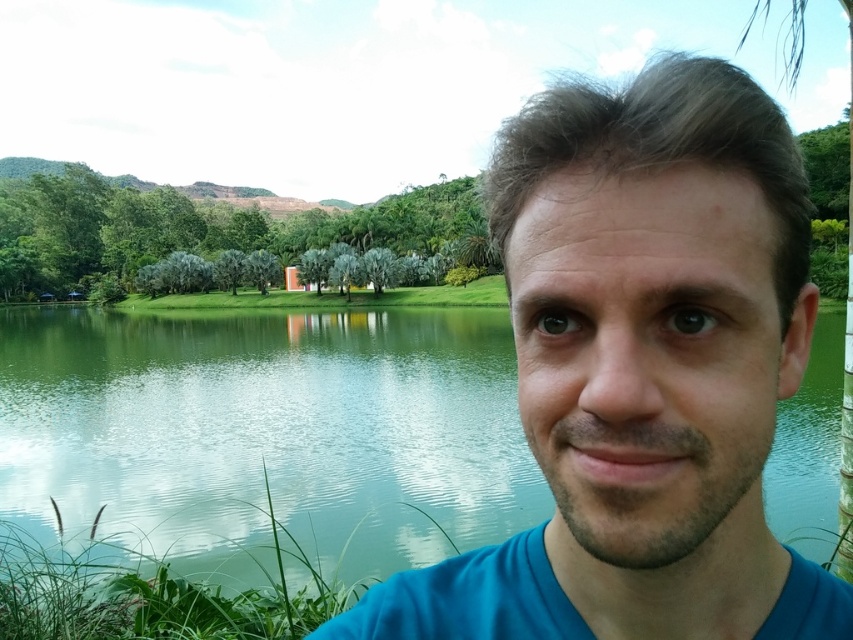
Does blue fabric face at center come behind green smooth water at center?

No.

Can you confirm if blue fabric face at center is wider than green smooth water at center?

In fact, blue fabric face at center might be narrower than green smooth water at center.

Is point (505, 566) positioned after point (395, 477)?

No.

Where is `blue fabric face at center`? This screenshot has width=853, height=640. blue fabric face at center is located at coordinates (641, 372).